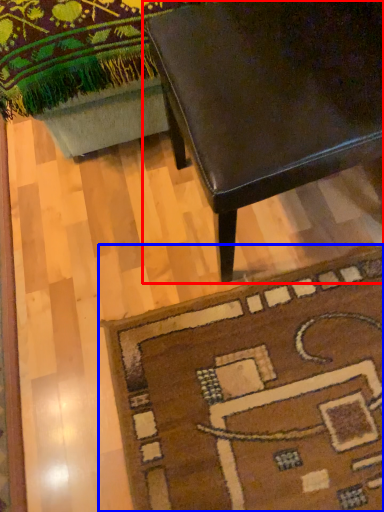
Question: Which point is further to the camera, table (highlighted by a red box) or mat (highlighted by a blue box)?

Choices:
 (A) table
 (B) mat

Answer: (B)